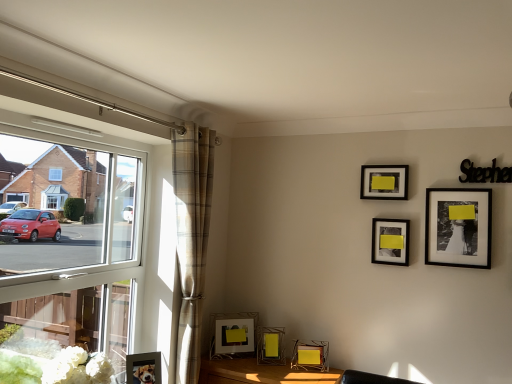
Question: Is metallic wireframe picture frame at lower center, which is the fourth picture frame in left-to-right order, taller than plaid fabric curtain at left?

Choices:
 (A) no
 (B) yes

Answer: (A)

Question: From a real-world perspective, is metallic wireframe picture frame at lower center, which is counted as the 4th picture frame, starting from the right, on plaid fabric curtain at left?

Choices:
 (A) yes
 (B) no

Answer: (B)

Question: From a real-world perspective, is metallic wireframe picture frame at lower center, which is the fourth picture frame in left-to-right order, positioned under plaid fabric curtain at left based on gravity?

Choices:
 (A) no
 (B) yes

Answer: (B)

Question: Considering the relative sizes of metallic wireframe picture frame at lower center, which is counted as the 4th picture frame, starting from the right, and plaid fabric curtain at left in the image provided, is metallic wireframe picture frame at lower center, which is counted as the 4th picture frame, starting from the right, thinner than plaid fabric curtain at left?

Choices:
 (A) yes
 (B) no

Answer: (A)

Question: Is metallic wireframe picture frame at lower center, which is the fourth picture frame in left-to-right order, aimed at plaid fabric curtain at left?

Choices:
 (A) yes
 (B) no

Answer: (B)

Question: In terms of width, does matte glass picture frame at lower center, the 2th picture frame in the left-to-right sequence, look wider or thinner when compared to metallic gold table at lower center?

Choices:
 (A) wide
 (B) thin

Answer: (B)

Question: In the image, is matte glass picture frame at lower center, the 2th picture frame in the left-to-right sequence, on the left side or the right side of metallic gold table at lower center?

Choices:
 (A) left
 (B) right

Answer: (A)

Question: Is matte glass picture frame at lower center, the 2th picture frame in the left-to-right sequence, bigger or smaller than metallic gold table at lower center?

Choices:
 (A) small
 (B) big

Answer: (A)

Question: Do you think matte glass picture frame at lower center, the 2th picture frame in the left-to-right sequence, is within metallic gold table at lower center, or outside of it?

Choices:
 (A) outside
 (B) inside

Answer: (A)

Question: Is point (244, 332) closer or farther from the camera than point (489, 215)?

Choices:
 (A) farther
 (B) closer

Answer: (A)

Question: Is matte glass picture frame at lower center, the 2th picture frame in the left-to-right sequence, wider or thinner than black matte picture frame at upper right, the 1th picture frame viewed from the right?

Choices:
 (A) wide
 (B) thin

Answer: (A)

Question: Relative to black matte picture frame at upper right, the 1th picture frame viewed from the right, is matte glass picture frame at lower center, marked as the 6th picture frame in a right-to-left arrangement, in front or behind?

Choices:
 (A) front
 (B) behind

Answer: (B)

Question: Is matte glass picture frame at lower center, marked as the 6th picture frame in a right-to-left arrangement, inside the boundaries of black matte picture frame at upper right, the 1th picture frame viewed from the right, or outside?

Choices:
 (A) inside
 (B) outside

Answer: (B)

Question: Considering the positions of matte glass picture frame at lower center, the 2th picture frame in the left-to-right sequence, and plaid fabric curtain at left in the image, is matte glass picture frame at lower center, the 2th picture frame in the left-to-right sequence, bigger or smaller than plaid fabric curtain at left?

Choices:
 (A) small
 (B) big

Answer: (A)

Question: In terms of height, does matte glass picture frame at lower center, marked as the 6th picture frame in a right-to-left arrangement, look taller or shorter compared to plaid fabric curtain at left?

Choices:
 (A) short
 (B) tall

Answer: (A)